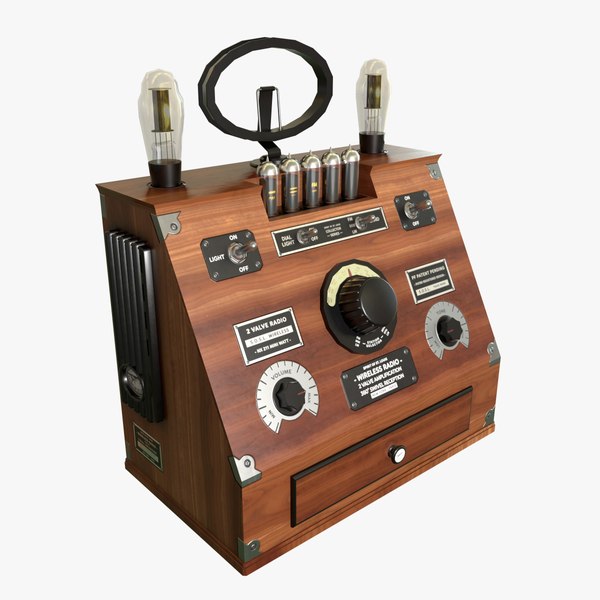
I want to click on space above the radio, so click(260, 21).